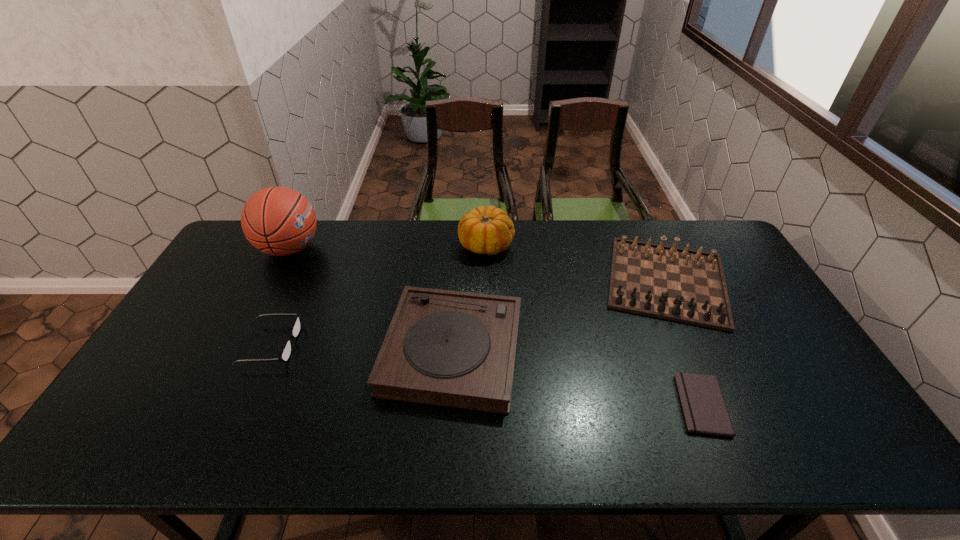
This screenshot has height=540, width=960. What are the coordinates of `blank area at the far edge` in the screenshot? It's located at (569, 224).

In order to click on vacant space at the near edge of the desktop in this screenshot , I will do `click(617, 429)`.

Locate an element on the screen. This screenshot has width=960, height=540. vacant space at the left edge of the desktop is located at coordinates (257, 280).

What are the coordinates of `free region at the right edge` in the screenshot? It's located at (767, 392).

At what (x,y) coordinates should I click in order to perform the action: click on vacant region between the tallest object and the spectacles. Please return your answer as a coordinate pair (x, y). Image resolution: width=960 pixels, height=540 pixels. Looking at the image, I should click on (280, 296).

Identify the location of unoccupied area between the chessboard and the shortest object. (684, 343).

At what (x,y) coordinates should I click in order to perform the action: click on vacant area between the basketball and the gourd. Please return your answer as a coordinate pair (x, y). Looking at the image, I should click on (388, 246).

In order to click on free space between the phonograph record and the fifth tallest object in this screenshot , I will do `click(362, 347)`.

You are a GUI agent. You are given a task and a screenshot of the screen. Output one action in this format:
    pyautogui.click(x=<x>, y=<y>)
    Task: Click on the vacant point located between the phonograph record and the spectacles
    This screenshot has width=960, height=540.
    Given the screenshot: What is the action you would take?
    (x=362, y=347)

Image resolution: width=960 pixels, height=540 pixels. What are the coordinates of `vacant space that is in between the basketball and the phonograph record` in the screenshot? It's located at click(371, 299).